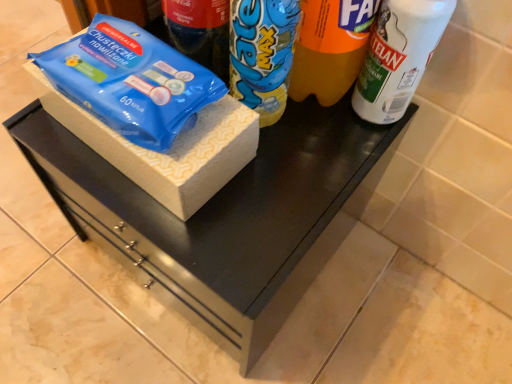
What are the coordinates of `unoccupied area in front of yellow matte drinking straw at center` in the screenshot? It's located at (286, 187).